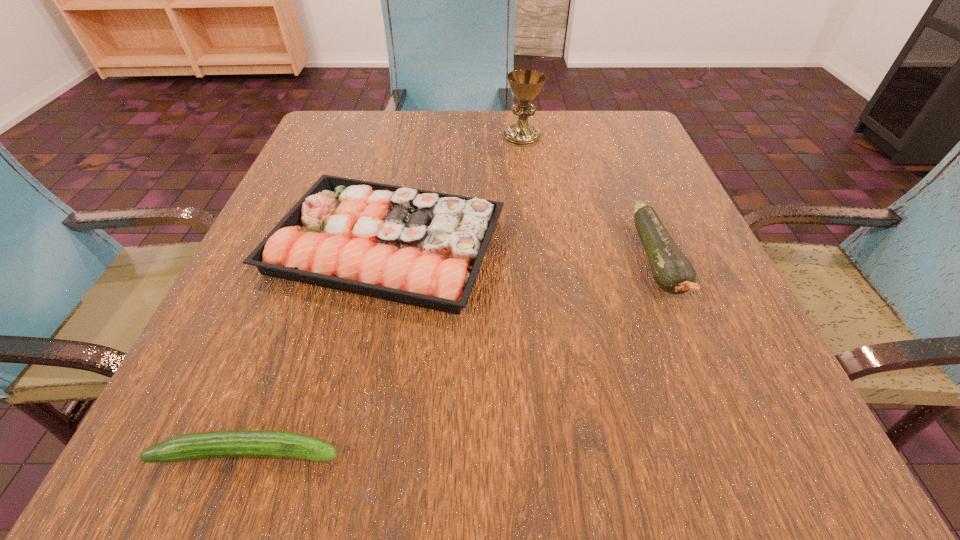
In the image, there is a desktop. Identify the location of vacant space at the far left corner. The width and height of the screenshot is (960, 540). (360, 130).

In order to click on vacant space at the near left corner in this screenshot , I will do `click(171, 488)`.

Image resolution: width=960 pixels, height=540 pixels. What are the coordinates of `free spot at the far right corner of the desktop` in the screenshot? It's located at (664, 163).

In the image, there is a desktop. At what (x,y) coordinates should I click in order to perform the action: click on blank space at the near right corner. Please return your answer as a coordinate pair (x, y). The width and height of the screenshot is (960, 540). Looking at the image, I should click on (782, 428).

Where is `vacant area that lies between the nearest object and the taller zucchini`? This screenshot has width=960, height=540. vacant area that lies between the nearest object and the taller zucchini is located at coordinates (453, 356).

The height and width of the screenshot is (540, 960). Identify the location of vacant space in between the nearest object and the farther zucchini. (453, 356).

The height and width of the screenshot is (540, 960). I want to click on free space between the chalice and the rightmost object, so click(589, 199).

Find the location of a particular element. The width and height of the screenshot is (960, 540). vacant region between the shortest object and the third tallest object is located at coordinates (317, 348).

The width and height of the screenshot is (960, 540). Identify the location of empty space between the platter and the third object from left to right. (454, 191).

Identify the location of free space between the second shortest object and the tallest object. The height and width of the screenshot is (540, 960). (454, 191).